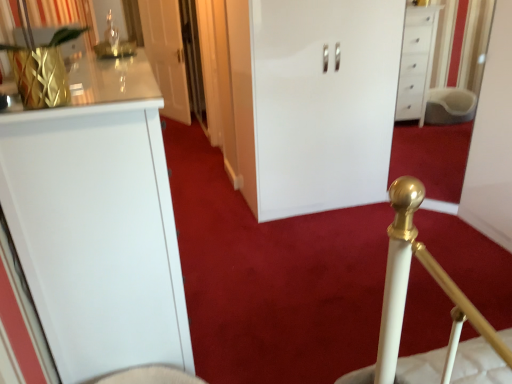
Question: Are gold metallic curtain at upper left and white glossy door at upper center, which is the first door in back-to-front order, far apart?

Choices:
 (A) no
 (B) yes

Answer: (B)

Question: Is gold metallic curtain at upper left looking in the opposite direction of white glossy door at upper center, which appears as the first door when viewed from the left?

Choices:
 (A) yes
 (B) no

Answer: (B)

Question: Is gold metallic curtain at upper left wider than white glossy door at upper center, the 2th door positioned from the front?

Choices:
 (A) yes
 (B) no

Answer: (A)

Question: Considering the relative sizes of gold metallic curtain at upper left and white glossy door at upper center, which is the first door in back-to-front order, in the image provided, is gold metallic curtain at upper left shorter than white glossy door at upper center, which is the first door in back-to-front order,?

Choices:
 (A) yes
 (B) no

Answer: (A)

Question: From the image's perspective, is gold metallic curtain at upper left located above white glossy door at upper center, which appears as the first door when viewed from the left?

Choices:
 (A) no
 (B) yes

Answer: (A)

Question: Which is correct: white glossy cabinet at center, which is counted as the first door, starting from the right, is inside gold metallic curtain at upper left, or outside of it?

Choices:
 (A) outside
 (B) inside

Answer: (A)

Question: Is point (280, 142) closer or farther from the camera than point (74, 4)?

Choices:
 (A) farther
 (B) closer

Answer: (A)

Question: Is white glossy cabinet at center, which is counted as the first door, starting from the right, taller or shorter than gold metallic curtain at upper left?

Choices:
 (A) tall
 (B) short

Answer: (A)

Question: Is white glossy cabinet at center, which appears as the first door when viewed from the front, to the left or to the right of gold metallic curtain at upper left in the image?

Choices:
 (A) left
 (B) right

Answer: (B)

Question: Considering their positions, is gold metallic curtain at upper left located in front of or behind white glossy cabinet at center, which ranks as the 2th door in left-to-right order?

Choices:
 (A) front
 (B) behind

Answer: (A)

Question: Is gold metallic curtain at upper left taller or shorter than white glossy cabinet at center, which ranks as the 2th door in left-to-right order?

Choices:
 (A) short
 (B) tall

Answer: (A)

Question: From a real-world perspective, relative to white glossy cabinet at center, which appears as the first door when viewed from the front, is gold metallic curtain at upper left vertically above or below?

Choices:
 (A) below
 (B) above

Answer: (B)

Question: Considering the positions of gold metallic curtain at upper left and white glossy cabinet at center, which is counted as the first door, starting from the right, in the image, is gold metallic curtain at upper left wider or thinner than white glossy cabinet at center, which is counted as the first door, starting from the right,?

Choices:
 (A) wide
 (B) thin

Answer: (B)

Question: From the image's perspective, is white glossy cabinet at center, which ranks as the 2th door in left-to-right order, located above or below white glossy door at upper center, the 2th door in the right-to-left sequence?

Choices:
 (A) above
 (B) below

Answer: (B)

Question: Considering the positions of point (272, 107) and point (172, 36), is point (272, 107) closer or farther from the camera than point (172, 36)?

Choices:
 (A) closer
 (B) farther

Answer: (A)